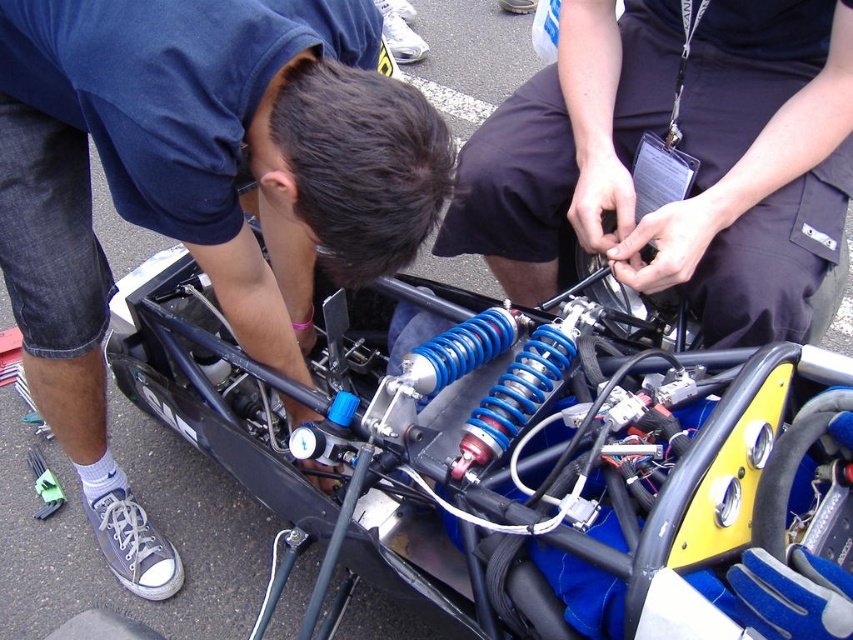
Which is more to the right, blue metallic suspension at center or blue rubber hose at center?

blue rubber hose at center

Consider the image. Which of these two, blue metallic suspension at center or blue rubber hose at center, stands taller?

blue metallic suspension at center

The width and height of the screenshot is (853, 640). What do you see at coordinates (514, 451) in the screenshot? I see `blue metallic suspension at center` at bounding box center [514, 451].

Locate an element on the screen. The height and width of the screenshot is (640, 853). blue metallic suspension at center is located at coordinates (514, 451).

Does point (251, 422) come closer to viewer compared to point (178, 237)?

That is False.

Measure the distance between blue metallic suspension at center and camera.

blue metallic suspension at center is 94.86 centimeters away from camera.

At what (x,y) coordinates should I click in order to perform the action: click on blue metallic suspension at center. Please return your answer as a coordinate pair (x, y). The width and height of the screenshot is (853, 640). Looking at the image, I should click on (514, 451).

Who is shorter, blue metallic coil at center or blue rubber hose at center?

Standing shorter between the two is blue rubber hose at center.

Between point (398, 157) and point (813, 52), which one is positioned in front?

Point (398, 157) is more forward.

Locate an element on the screen. blue metallic coil at center is located at coordinates (196, 192).